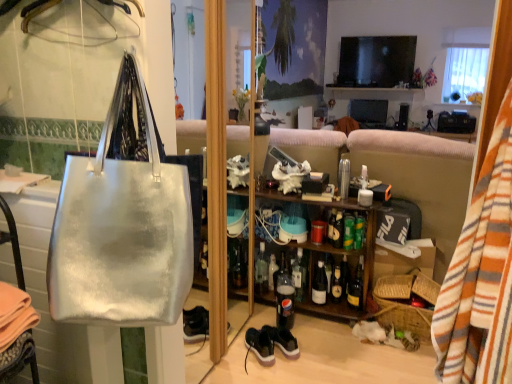
Question: Is the depth of metallic silver hanger at upper left greater than that of translucent glass bottle at center, the fourth bottle when ordered from left to right?

Choices:
 (A) yes
 (B) no

Answer: (B)

Question: Does metallic silver hanger at upper left appear on the right side of translucent glass bottle at center, the fifth bottle positioned from the right?

Choices:
 (A) no
 (B) yes

Answer: (A)

Question: From the image's perspective, is metallic silver hanger at upper left beneath translucent glass bottle at center, the fifth bottle positioned from the right?

Choices:
 (A) no
 (B) yes

Answer: (A)

Question: From the image's perspective, is metallic silver hanger at upper left located above translucent glass bottle at center, the fifth bottle positioned from the right?

Choices:
 (A) yes
 (B) no

Answer: (A)

Question: Is metallic silver hanger at upper left to the left of translucent glass bottle at center, the fifth bottle positioned from the right, from the viewer's perspective?

Choices:
 (A) yes
 (B) no

Answer: (A)

Question: Would you say metallic silver hanger at upper left contains translucent glass bottle at center, the fifth bottle positioned from the right?

Choices:
 (A) no
 (B) yes

Answer: (A)

Question: From a real-world perspective, is metallic silver cup at center physically below matte cardboard box at lower right?

Choices:
 (A) no
 (B) yes

Answer: (A)

Question: Considering the relative positions of metallic silver cup at center and matte cardboard box at lower right in the image provided, is metallic silver cup at center to the left of matte cardboard box at lower right from the viewer's perspective?

Choices:
 (A) yes
 (B) no

Answer: (A)

Question: Is metallic silver cup at center outside of matte cardboard box at lower right?

Choices:
 (A) no
 (B) yes

Answer: (B)

Question: Is matte cardboard box at lower right a part of metallic silver cup at center?

Choices:
 (A) yes
 (B) no

Answer: (B)

Question: Is the depth of metallic silver cup at center greater than that of matte cardboard box at lower right?

Choices:
 (A) no
 (B) yes

Answer: (A)

Question: Considering the relative sizes of metallic silver cup at center and matte cardboard box at lower right in the image provided, is metallic silver cup at center taller than matte cardboard box at lower right?

Choices:
 (A) no
 (B) yes

Answer: (A)

Question: Would you say matte cardboard box at lower right is outside clear glass bottle at center, which is the 8th bottle in right-to-left order?

Choices:
 (A) yes
 (B) no

Answer: (A)